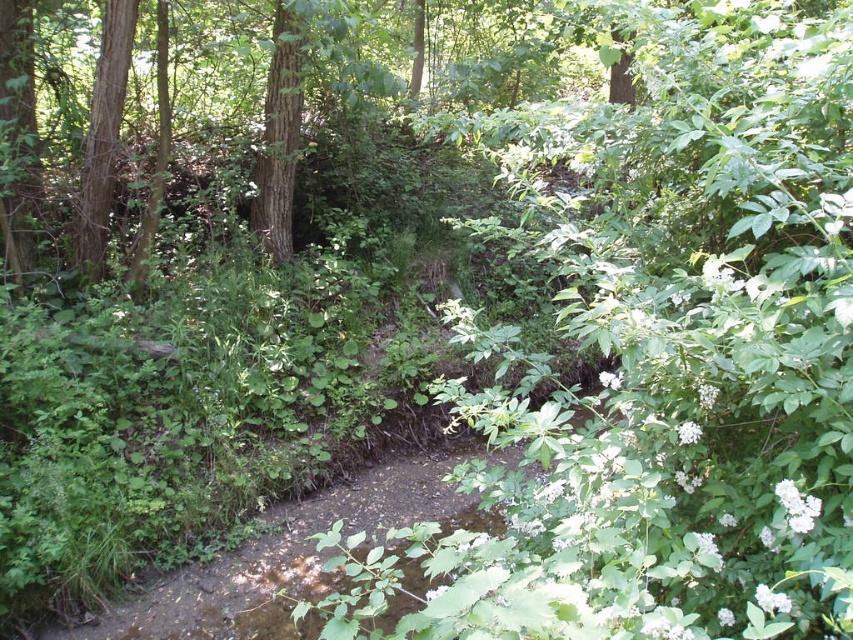
Question: Observing the image, what is the correct spatial positioning of smooth brown tree trunk at left in reference to green rough bark tree at center?

Choices:
 (A) left
 (B) right

Answer: (A)

Question: Among these objects, which one is farthest from the camera?

Choices:
 (A) smooth brown tree trunk at left
 (B) green rough bark tree at center

Answer: (A)

Question: Is smooth brown tree trunk at left below green rough bark tree at center?

Choices:
 (A) yes
 (B) no

Answer: (A)

Question: Among these objects, which one is nearest to the camera?

Choices:
 (A) smooth brown tree trunk at left
 (B) green rough bark tree at center

Answer: (B)

Question: Observing the image, what is the correct spatial positioning of smooth brown tree trunk at left in reference to green rough bark tree at center?

Choices:
 (A) right
 (B) left

Answer: (B)